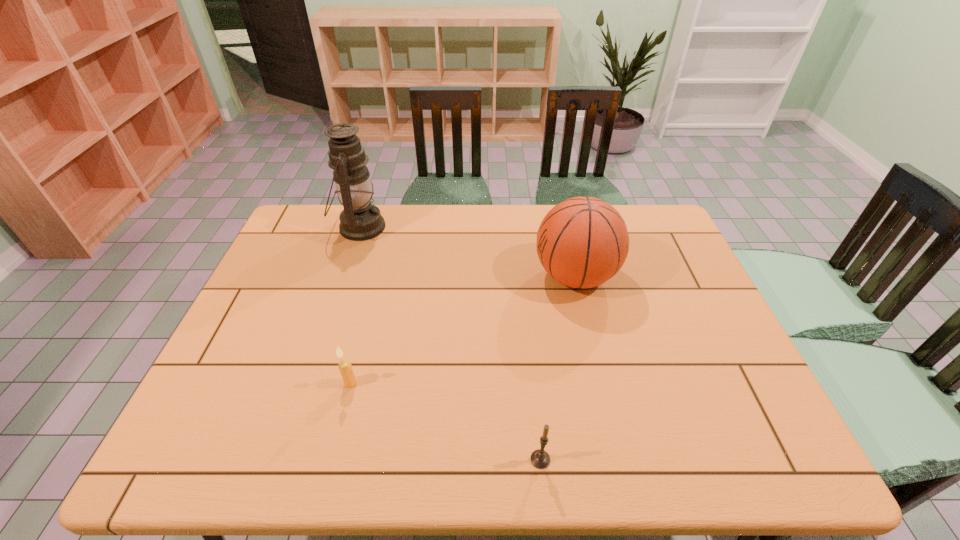
At what (x,y) coordinates should I click in order to perform the action: click on the tallest object. Please return your answer as a coordinate pair (x, y). This screenshot has width=960, height=540. Looking at the image, I should click on (360, 220).

Find the location of `the farthest object`. the farthest object is located at coordinates (360, 220).

You are a GUI agent. You are given a task and a screenshot of the screen. Output one action in this format:
    pyautogui.click(x=<x>, y=<y>)
    Task: Click on the third nearest object
    Image resolution: width=960 pixels, height=540 pixels.
    Given the screenshot: What is the action you would take?
    pyautogui.click(x=582, y=242)

Where is `basketball`? Image resolution: width=960 pixels, height=540 pixels. basketball is located at coordinates (582, 242).

Find the location of a particular element. The width and height of the screenshot is (960, 540). the left candle is located at coordinates (345, 367).

Identify the location of the farther candle. The height and width of the screenshot is (540, 960). (345, 367).

Where is `the nearer candle`? This screenshot has width=960, height=540. the nearer candle is located at coordinates (540, 458).

Identify the location of the right candle. (540, 458).

Where is `free space located 0.310m on the right of the tallest object`? This screenshot has height=540, width=960. free space located 0.310m on the right of the tallest object is located at coordinates (476, 227).

I want to click on free region located on the left of the second farthest object, so click(467, 276).